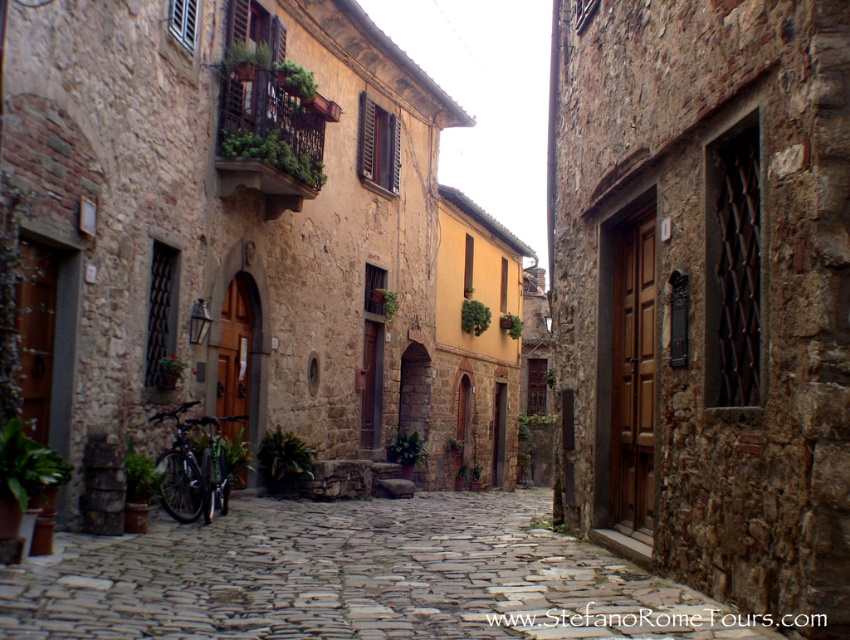
Measure the distance between point (829, 61) and camera.

Point (829, 61) is 4.36 meters away from camera.

Is brown wooden door at center bigger than stone cobblestone path at center?

Incorrect, brown wooden door at center is not larger than stone cobblestone path at center.

The height and width of the screenshot is (640, 850). What do you see at coordinates (706, 292) in the screenshot? I see `brown wooden door at center` at bounding box center [706, 292].

Locate an element on the screen. The height and width of the screenshot is (640, 850). brown wooden door at center is located at coordinates (706, 292).